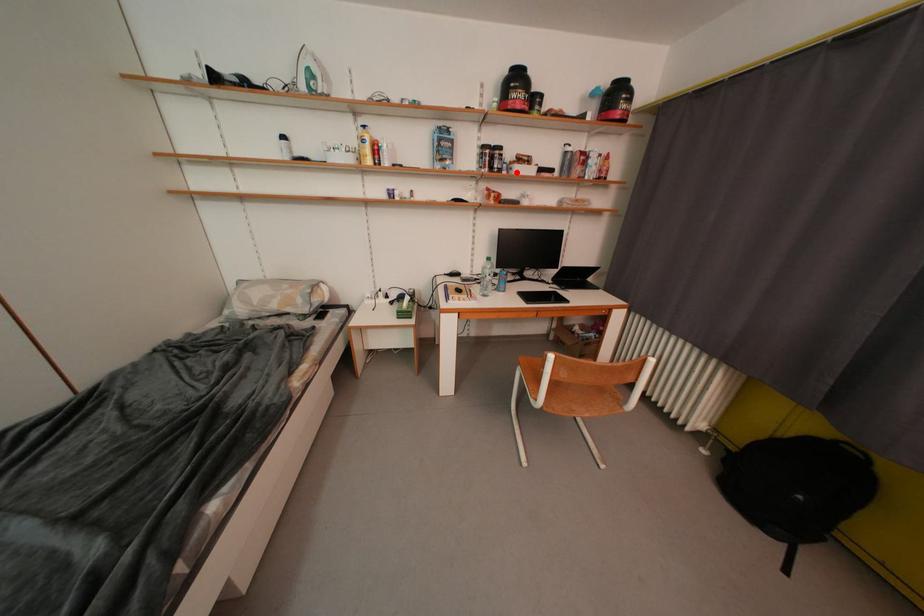
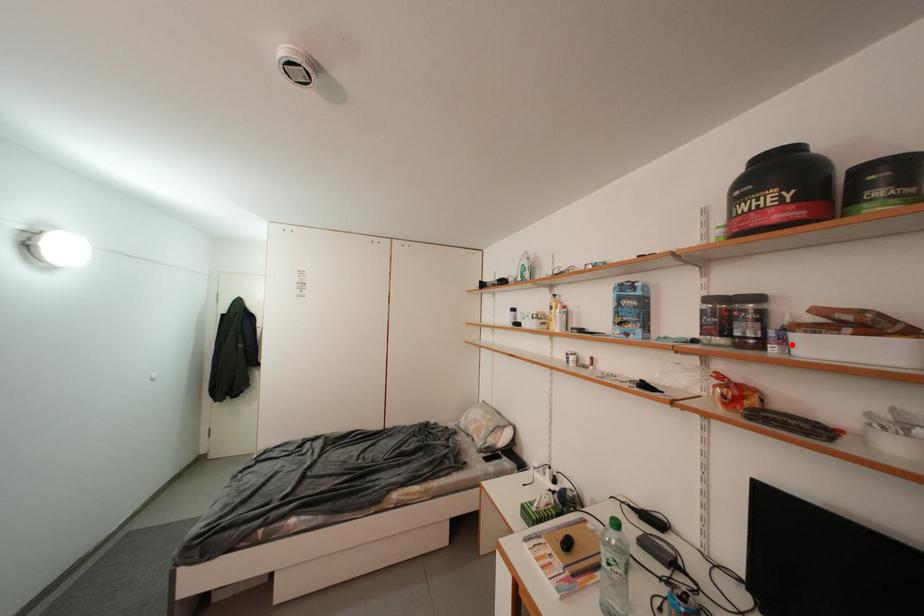
I am providing you with two images of the same scene from different viewpoints. A red point is marked on the first image and another point is marked on the second image. Is the red point in image1 aligned with the point shown in image2?

Answer: Yes